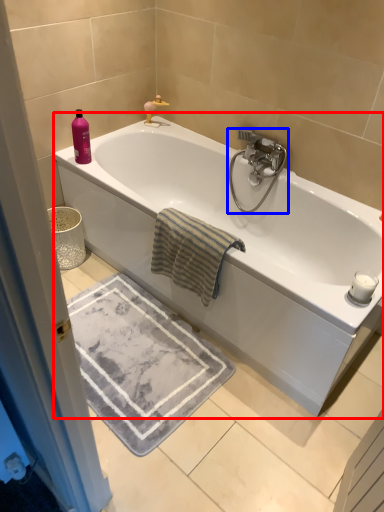
Question: Which of the following is the farthest to the observer, bathtub (highlighted by a red box) or tap (highlighted by a blue box)?

Choices:
 (A) bathtub
 (B) tap

Answer: (B)